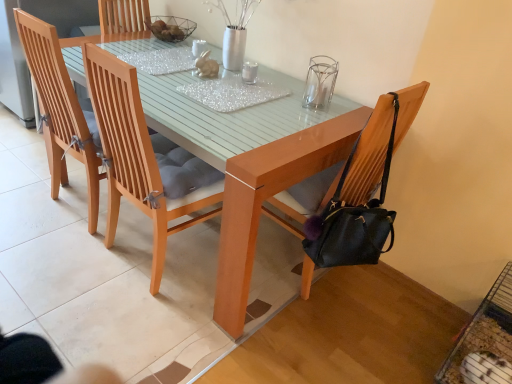
I want to click on space that is in front of transparent glass candle holder at upper center, so click(x=311, y=117).